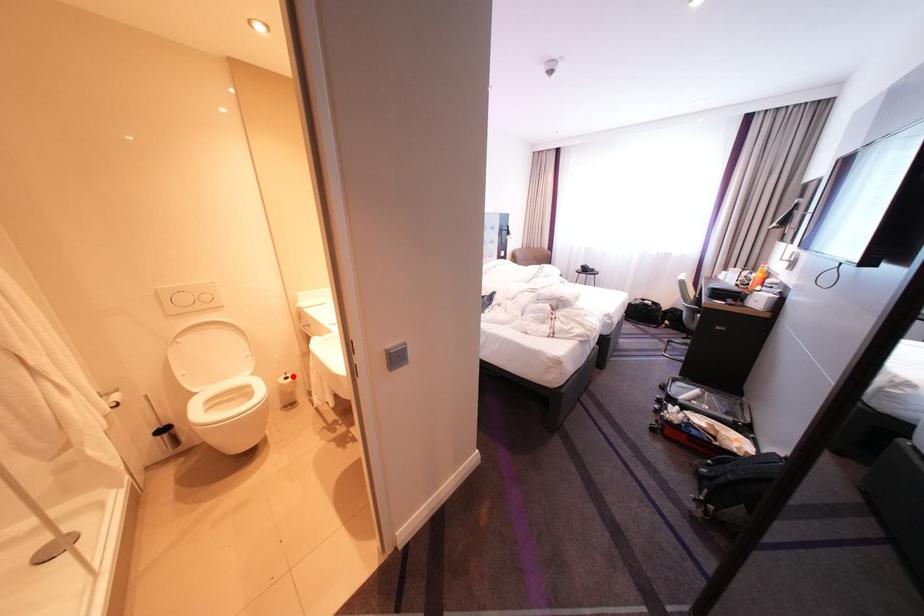
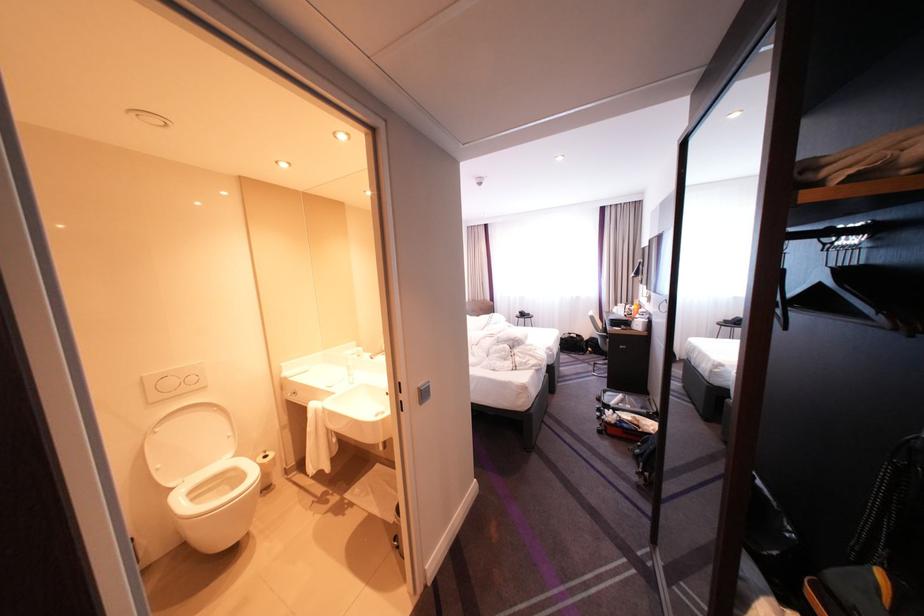
The point at the highlighted location is marked in the first image. Where is the corresponding point in the second image?

(271, 456)